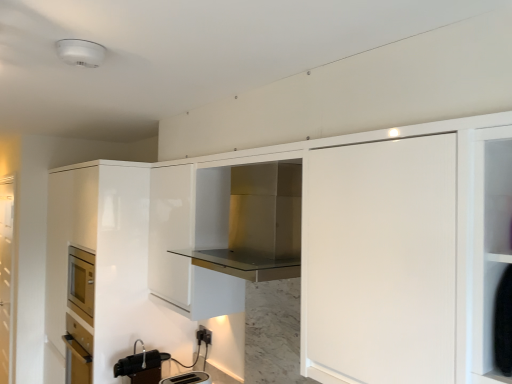
Question: Is matte black toaster at lower center, arranged as the 2th appliance when viewed from the left, facing towards metallic silver faucet at lower center, marked as the 2th appliance in a right-to-left arrangement?

Choices:
 (A) yes
 (B) no

Answer: (B)

Question: Does matte black toaster at lower center, arranged as the 2th appliance when viewed from the left, appear on the right side of metallic silver faucet at lower center, placed as the 1th appliance when sorted from left to right?

Choices:
 (A) no
 (B) yes

Answer: (B)

Question: Does matte black toaster at lower center, acting as the first appliance starting from the right, have a larger size compared to metallic silver faucet at lower center, marked as the 2th appliance in a right-to-left arrangement?

Choices:
 (A) no
 (B) yes

Answer: (A)

Question: From the image's perspective, does matte black toaster at lower center, arranged as the 2th appliance when viewed from the left, appear higher than metallic silver faucet at lower center, marked as the 2th appliance in a right-to-left arrangement?

Choices:
 (A) yes
 (B) no

Answer: (B)

Question: Considering the relative sizes of matte black toaster at lower center, arranged as the 2th appliance when viewed from the left, and metallic silver faucet at lower center, marked as the 2th appliance in a right-to-left arrangement, in the image provided, is matte black toaster at lower center, arranged as the 2th appliance when viewed from the left, thinner than metallic silver faucet at lower center, marked as the 2th appliance in a right-to-left arrangement,?

Choices:
 (A) yes
 (B) no

Answer: (B)

Question: Would you say metallic silver faucet at lower center, marked as the 2th appliance in a right-to-left arrangement, is part of matte black toaster at lower center, acting as the first appliance starting from the right,'s contents?

Choices:
 (A) yes
 (B) no

Answer: (B)

Question: Is black plastic electric outlet at lower center surrounding stainless steel range hood at center, the first cabinetry when ordered from right to left?

Choices:
 (A) yes
 (B) no

Answer: (B)

Question: Is black plastic electric outlet at lower center not near stainless steel range hood at center, the 2th cabinetry viewed from the back?

Choices:
 (A) yes
 (B) no

Answer: (A)

Question: Is black plastic electric outlet at lower center outside of stainless steel range hood at center, marked as the 2th cabinetry in a left-to-right arrangement?

Choices:
 (A) yes
 (B) no

Answer: (A)

Question: Is black plastic electric outlet at lower center facing towards stainless steel range hood at center, the first cabinetry when ordered from right to left?

Choices:
 (A) yes
 (B) no

Answer: (B)

Question: From a real-world perspective, is black plastic electric outlet at lower center under stainless steel range hood at center, the first cabinetry when ordered from right to left?

Choices:
 (A) yes
 (B) no

Answer: (A)

Question: Is black plastic electric outlet at lower center to the right of stainless steel range hood at center, the first cabinetry when ordered from right to left, from the viewer's perspective?

Choices:
 (A) no
 (B) yes

Answer: (A)

Question: Is metallic silver faucet at lower center, marked as the 2th appliance in a right-to-left arrangement, beside glossy white cabinet at left, positioned as the 1th cabinetry in left-to-right order?

Choices:
 (A) yes
 (B) no

Answer: (B)